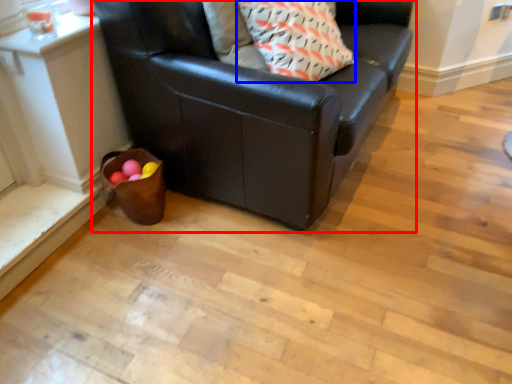
Question: Among these objects, which one is farthest to the camera, studio couch (highlighted by a red box) or throw pillow (highlighted by a blue box)?

Choices:
 (A) studio couch
 (B) throw pillow

Answer: (B)